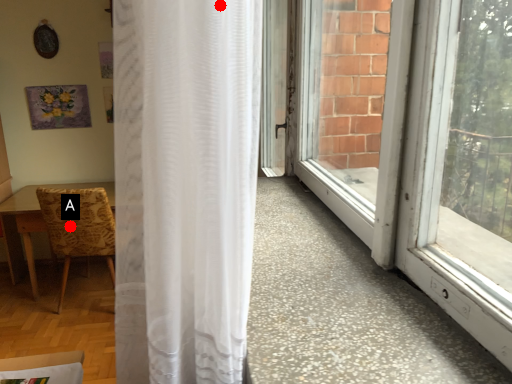
Question: Two points are circled on the image, labeled by A and B beside each circle. Which point appears farthest from the camera in this image?

Choices:
 (A) A is further
 (B) B is further

Answer: (A)